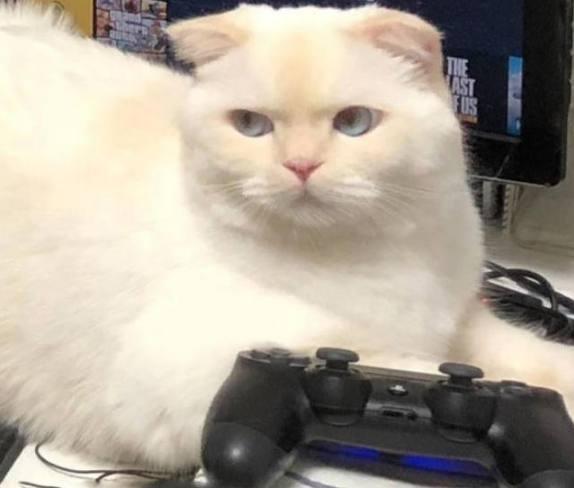
At what (x,y) coordinates should I click in order to perform the action: click on tv screen. Please return your answer as a coordinate pair (x, y). Looking at the image, I should click on (487, 60).